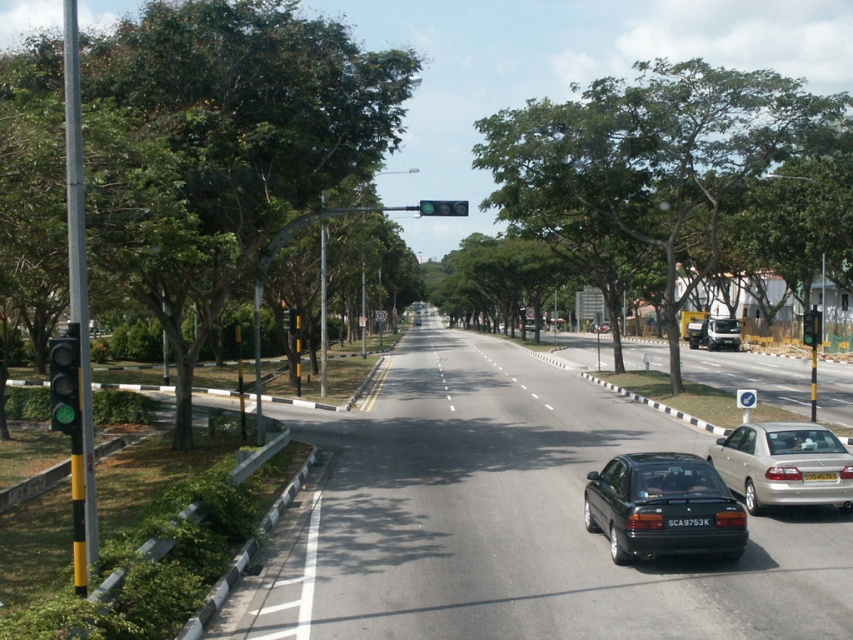
You are a delivery driver and you need to park your truck, which is 2 meters wide, on the side of the road. The parking spot is next to the green glass traffic light at left and the metallic silver van at center. Can your truck fit between them?

The green glass traffic light at left is narrower than the metallic silver van at center. However, the combined width of both objects is not provided, so it is impossible to determine if there is enough space for the truck.

You are a pedestrian standing at the center of the road. You see the green glass traffic light at left. In which direction should you walk to reach it?

The green glass traffic light at left is located at point (64,384), so you should walk to the left to reach it.

You are driving a car and see the green glass traffic light at left and the metallic silver van at center. Which object is closer to the left edge of the road?

The green glass traffic light at left is closer to the left edge of the road because it is positioned on the left side of the metallic silver van at center.